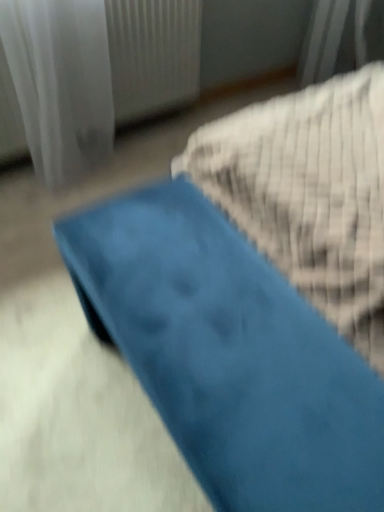
Question: Considering the positions of white sheer curtain at upper left and blue fabric ottoman at center in the image, is white sheer curtain at upper left taller or shorter than blue fabric ottoman at center?

Choices:
 (A) short
 (B) tall

Answer: (B)

Question: Considering the positions of white sheer curtain at upper left and blue fabric ottoman at center in the image, is white sheer curtain at upper left bigger or smaller than blue fabric ottoman at center?

Choices:
 (A) big
 (B) small

Answer: (B)

Question: Is white sheer curtain at upper left inside or outside of blue fabric ottoman at center?

Choices:
 (A) inside
 (B) outside

Answer: (B)

Question: Would you say blue fabric ottoman at center is inside or outside white sheer curtain at upper left?

Choices:
 (A) outside
 (B) inside

Answer: (A)

Question: From the image's perspective, is blue fabric ottoman at center located above or below white sheer curtain at upper left?

Choices:
 (A) below
 (B) above

Answer: (A)

Question: Is point (175, 423) positioned closer to the camera than point (49, 48)?

Choices:
 (A) closer
 (B) farther

Answer: (A)

Question: Considering the positions of blue fabric ottoman at center and white sheer curtain at upper left in the image, is blue fabric ottoman at center bigger or smaller than white sheer curtain at upper left?

Choices:
 (A) big
 (B) small

Answer: (A)